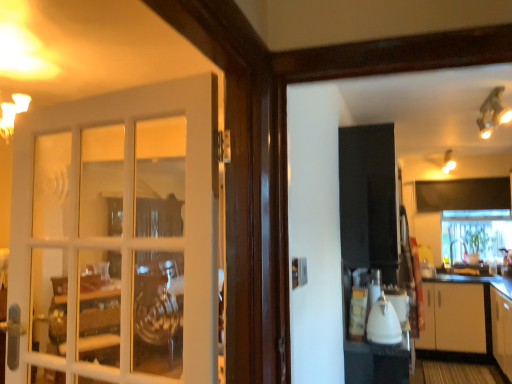
Question: Can you confirm if white glossy countertop at right is shorter than white glossy kettle at center?

Choices:
 (A) no
 (B) yes

Answer: (B)

Question: Can you confirm if white glossy countertop at right is smaller than white glossy kettle at center?

Choices:
 (A) no
 (B) yes

Answer: (A)

Question: Is white glossy countertop at right behind white glossy kettle at center?

Choices:
 (A) no
 (B) yes

Answer: (B)

Question: Considering the relative sizes of white glossy countertop at right and white glossy kettle at center in the image provided, is white glossy countertop at right thinner than white glossy kettle at center?

Choices:
 (A) no
 (B) yes

Answer: (A)

Question: Is white glossy countertop at right bigger than white glossy kettle at center?

Choices:
 (A) yes
 (B) no

Answer: (A)

Question: Is the depth of white glossy countertop at right less than that of white glossy kettle at center?

Choices:
 (A) no
 (B) yes

Answer: (A)

Question: Is clear glass window at center positioned behind white glass door at left?

Choices:
 (A) no
 (B) yes

Answer: (B)

Question: Is clear glass window at center at the left side of white glass door at left?

Choices:
 (A) yes
 (B) no

Answer: (B)

Question: From a real-world perspective, is clear glass window at center located beneath white glass door at left?

Choices:
 (A) no
 (B) yes

Answer: (B)

Question: From a real-world perspective, is clear glass window at center located higher than white glass door at left?

Choices:
 (A) no
 (B) yes

Answer: (A)

Question: Is clear glass window at center wider than white glass door at left?

Choices:
 (A) no
 (B) yes

Answer: (B)

Question: Does clear glass window at center have a lesser height compared to white glass door at left?

Choices:
 (A) no
 (B) yes

Answer: (B)

Question: Is white glossy countertop at right at the left side of clear glass window at center?

Choices:
 (A) yes
 (B) no

Answer: (A)